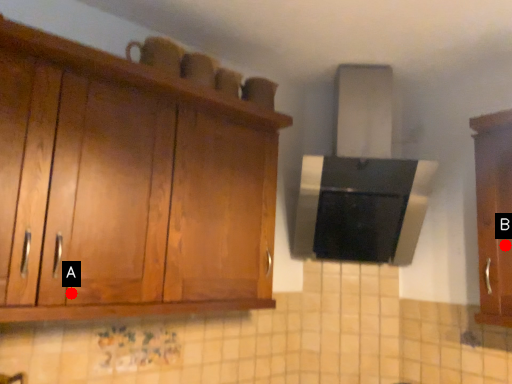
Question: Two points are circled on the image, labeled by A and B beside each circle. Which point is further to the camera?

Choices:
 (A) A is further
 (B) B is further

Answer: (B)